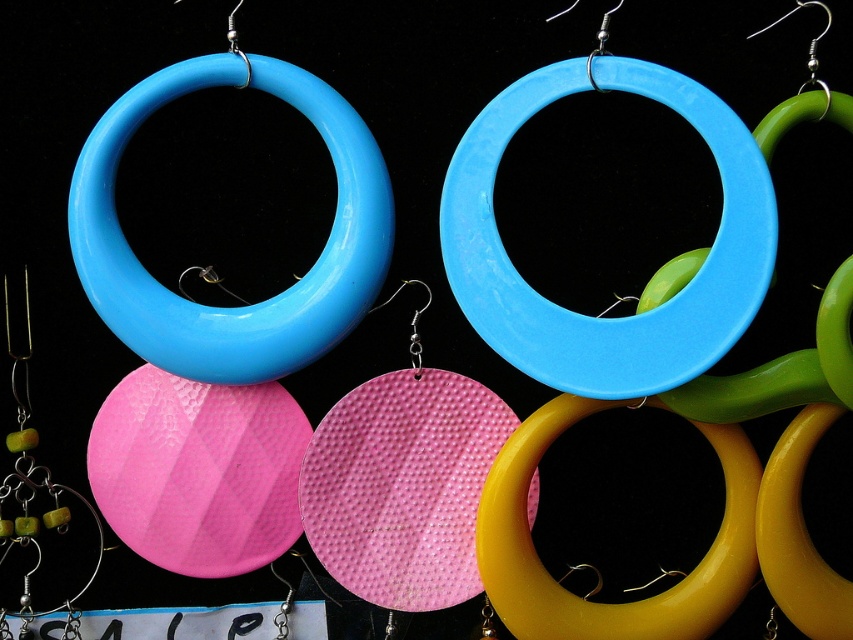
Between glossy plastic hoop at center and matte plastic hoop at upper left, which one appears on the left side from the viewer's perspective?

matte plastic hoop at upper left

Does point (633, 336) come closer to viewer compared to point (316, 84)?

Yes, point (633, 336) is in front of point (316, 84).

Image resolution: width=853 pixels, height=640 pixels. I want to click on glossy plastic hoop at center, so click(590, 316).

Where is `glossy plastic hoop at center`? glossy plastic hoop at center is located at coordinates (590, 316).

Does glossy plastic hoop at center appear under yellow glossy hoop at center?

Actually, glossy plastic hoop at center is above yellow glossy hoop at center.

Can you confirm if glossy plastic hoop at center is positioned above yellow glossy hoop at center?

Indeed, glossy plastic hoop at center is positioned over yellow glossy hoop at center.

Identify the location of glossy plastic hoop at center. (590, 316).

Is matte plastic hoop at upper left bigger than yellow glossy hoop at center?

Indeed, matte plastic hoop at upper left has a larger size compared to yellow glossy hoop at center.

Between matte plastic hoop at upper left and yellow glossy hoop at center, which one has less height?

yellow glossy hoop at center

Between point (372, 176) and point (668, 627), which one is positioned in front?

Point (372, 176) is in front.

Find the location of a particular element. Image resolution: width=853 pixels, height=640 pixels. matte plastic hoop at upper left is located at coordinates (254, 304).